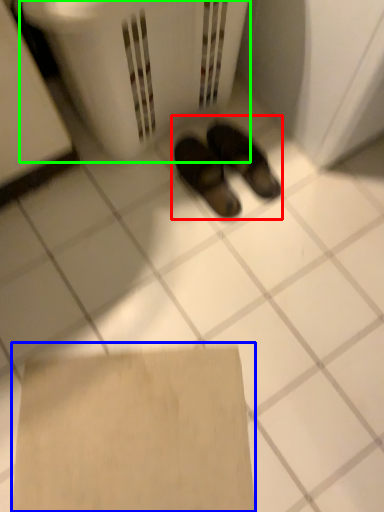
Question: Which object is the closest to the footwear (highlighted by a red box)? Choose among these: cardboard (highlighted by a blue box) or laundry basket (highlighted by a green box).

Choices:
 (A) cardboard
 (B) laundry basket

Answer: (B)